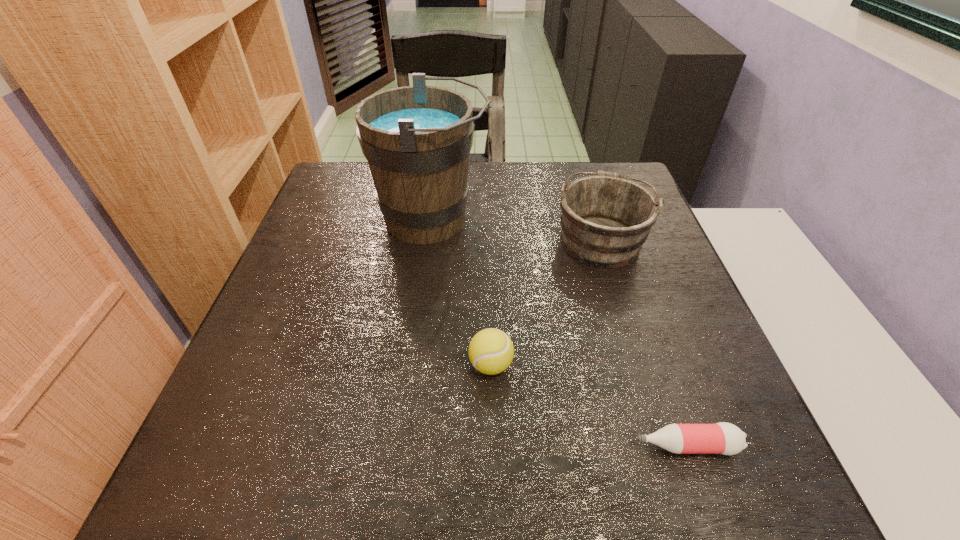
Find the location of a particular element. Image resolution: width=960 pixels, height=540 pixels. vacant space that satisfies the following two spatial constraints: 1. with a handle on the side of the taller wine bucket; 2. on the right side of the shorter wine bucket is located at coordinates pos(429,239).

Identify the location of free space that satisfies the following two spatial constraints: 1. with a handle on the side of the shorter wine bucket; 2. on the left side of the taller wine bucket. (429, 239).

Identify the location of vacant space that satisfies the following two spatial constraints: 1. on the back side of the right wine bucket; 2. with a handle on the side of the left wine bucket. (594, 219).

Identify the location of vacant space that satisfies the following two spatial constraints: 1. with a handle on the side of the left wine bucket; 2. on the left side of the shorter wine bucket. The height and width of the screenshot is (540, 960). (429, 239).

At what (x,y) coordinates should I click in order to perform the action: click on vacant region that satisfies the following two spatial constraints: 1. with a handle on the side of the taller wine bucket; 2. on the left side of the third shortest object. Please return your answer as a coordinate pair (x, y). Image resolution: width=960 pixels, height=540 pixels. Looking at the image, I should click on (429, 239).